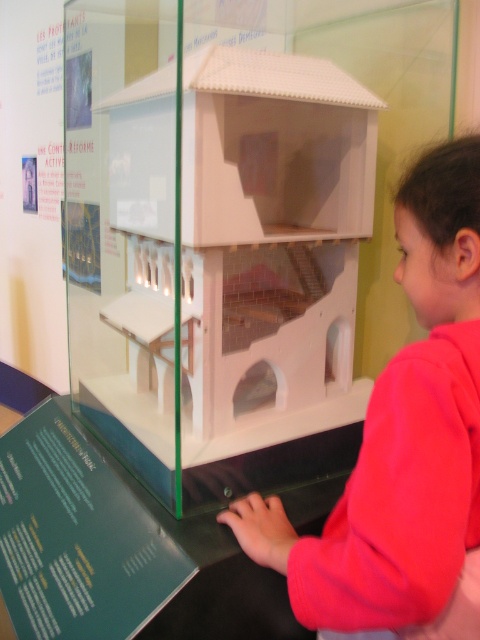
You are a visitor at a museum and see the transparent plastic model house at center and the pink fleece jacket at lower right. Which object is wider?

The transparent plastic model house at center is wider than the pink fleece jacket at lower right.

You are a visitor at a museum and want to take a photo of the transparent plastic model house at center. The museum allows photos but requires that you stand at least 1 meter away from exhibits. Can you take the photo without moving closer than the required distance?

The transparent plastic model house at center is 80.51 centimeters away from the viewer. Since 80.51 cm is less than 1 meter, you are too close to take the photo within the museum rules. You need to step back to meet the 1 meter requirement.

You are a visitor at a museum and see the transparent plastic model house at center and the pink fleece jacket at lower right. Which object is positioned higher in the image?

The transparent plastic model house at center is located above the pink fleece jacket at lower right, so it is positioned higher in the image.